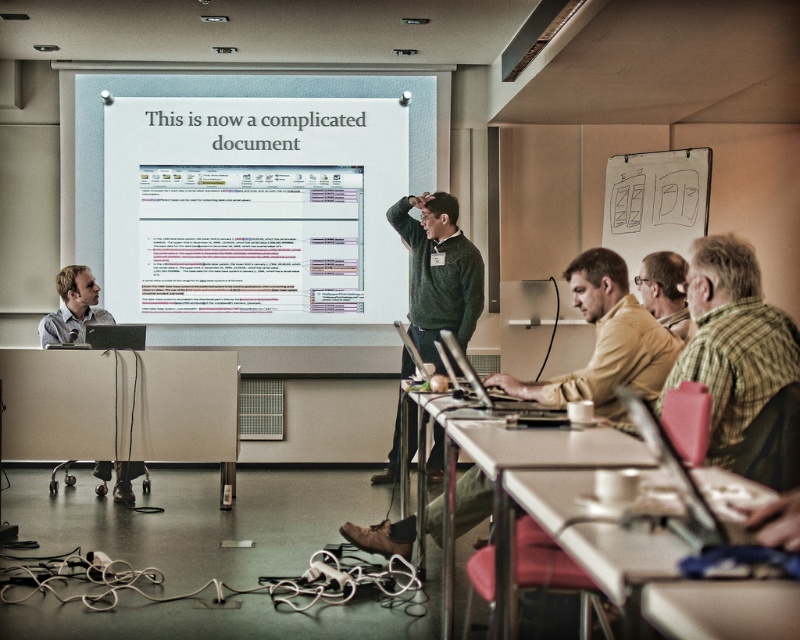
Question: Which point is closer to the camera?

Choices:
 (A) plaid shirt at right
 (B) beige plastic table at lower right
 (C) metallic gray table at lower center
 (D) green sweater at center

Answer: (B)

Question: Does light brown leather jacket at center appear on the left side of light brown leather shoes at lower left?

Choices:
 (A) yes
 (B) no

Answer: (B)

Question: Which object appears closest to the camera in this image?

Choices:
 (A) green sweater at center
 (B) plaid shirt at right
 (C) matte plastic table at lower left

Answer: (B)

Question: Where is light brown leather shoes at lower left located in relation to black matte laptop at center in the image?

Choices:
 (A) left
 (B) right

Answer: (A)

Question: Does light brown leather shoes at lower left come in front of plaid shirt at right?

Choices:
 (A) no
 (B) yes

Answer: (A)

Question: Which point appears closest to the camera in this image?

Choices:
 (A) [622, 230]
 (B) [448, 125]
 (C) [444, 554]
 (D) [444, 337]

Answer: (C)